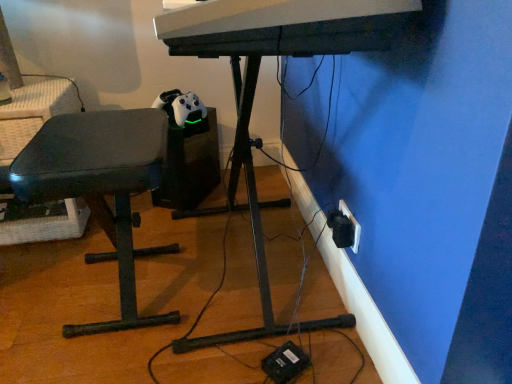
Where is `white plastic computer desk at center`? white plastic computer desk at center is located at coordinates [256, 84].

From the picture: Measure the distance between matte black bench at left and camera.

A distance of 35.08 inches exists between matte black bench at left and camera.

The height and width of the screenshot is (384, 512). Identify the location of white plastic electric outlet at lower right. (353, 225).

Would you say white plastic musical keyboard at upper center is part of white plastic computer desk at center's contents?

No, white plastic musical keyboard at upper center is not surrounded by white plastic computer desk at center.

Is white plastic computer desk at center positioned with its back to white plastic musical keyboard at upper center?

No, white plastic musical keyboard at upper center is not at the back of white plastic computer desk at center.

Does white plastic computer desk at center have a larger size compared to white plastic musical keyboard at upper center?

Yes, white plastic computer desk at center is bigger than white plastic musical keyboard at upper center.

Is the position of white plastic computer desk at center more distant than that of white plastic musical keyboard at upper center?

Yes, white plastic computer desk at center is behind white plastic musical keyboard at upper center.

Considering the sizes of objects white plastic electric outlet at lower right and matte black bench at left in the image provided, who is smaller, white plastic electric outlet at lower right or matte black bench at left?

white plastic electric outlet at lower right.

From the image's perspective, is white plastic electric outlet at lower right above or below matte black bench at left?

Clearly, from the image's perspective, white plastic electric outlet at lower right is below matte black bench at left.

Is white plastic electric outlet at lower right not near matte black bench at left?

That's not correct — white plastic electric outlet at lower right is a little close to matte black bench at left.

Identify the location of electric outlet below the white plastic computer desk at center (from a real-world perspective). The width and height of the screenshot is (512, 384). (353, 225).

From the image's perspective, is white plastic computer desk at center located above or below white plastic electric outlet at lower right?

Based on their image positions, white plastic computer desk at center is located above white plastic electric outlet at lower right.

Is white plastic computer desk at center surrounding white plastic electric outlet at lower right?

No, white plastic electric outlet at lower right is located outside of white plastic computer desk at center.

Can you see white plastic computer desk at center touching white plastic electric outlet at lower right?

There is a gap between white plastic computer desk at center and white plastic electric outlet at lower right.

Is white plastic musical keyboard at upper center oriented towards white plastic computer desk at center?

No, white plastic musical keyboard at upper center is not facing towards white plastic computer desk at center.

Is point (170, 20) closer or farther from the camera than point (257, 28)?

Point (170, 20) appears to be closer to the viewer than point (257, 28).

Consider the image. Can you confirm if white plastic musical keyboard at upper center is bigger than white plastic computer desk at center?

No, white plastic musical keyboard at upper center is not bigger than white plastic computer desk at center.

Looking at this image, do you think white plastic musical keyboard at upper center is within white plastic computer desk at center, or outside of it?

white plastic musical keyboard at upper center exists outside the volume of white plastic computer desk at center.

The width and height of the screenshot is (512, 384). Find the location of `furniture located underneath the white plastic musical keyboard at upper center (from a real-world perspective)`. furniture located underneath the white plastic musical keyboard at upper center (from a real-world perspective) is located at coordinates (101, 187).

Is white plastic musical keyboard at upper center at the left side of matte black bench at left?

Incorrect, white plastic musical keyboard at upper center is not on the left side of matte black bench at left.

Considering the sizes of objects white plastic musical keyboard at upper center and matte black bench at left in the image provided, who is shorter, white plastic musical keyboard at upper center or matte black bench at left?

white plastic musical keyboard at upper center is shorter.

Looking at this image, is the depth of white plastic electric outlet at lower right less than that of white plastic musical keyboard at upper center?

No.

In order to click on musical keyboard in front of the white plastic electric outlet at lower right in this screenshot , I will do `click(283, 27)`.

Does white plastic electric outlet at lower right have a greater width compared to white plastic musical keyboard at upper center?

No.

Is matte black bench at left at the back of white plastic computer desk at center?

Yes, matte black bench at left is at the back of white plastic computer desk at center.

Does point (345, 14) lie in front of point (109, 113)?

Yes.

In the image, is white plastic computer desk at center positioned in front of or behind matte black bench at left?

white plastic computer desk at center is positioned closer to the viewer than matte black bench at left.

Find the location of a particular element. musical keyboard on the left of white plastic computer desk at center is located at coordinates (283, 27).

You are a GUI agent. You are given a task and a screenshot of the screen. Output one action in this format:
    pyautogui.click(x=<x>, y=<y>)
    Task: Click on the furniture that is above the white plastic electric outlet at lower right (from a real-world perspective)
    
    Given the screenshot: What is the action you would take?
    pyautogui.click(x=101, y=187)

From the image, which object appears to be farther from white plastic computer desk at center, white plastic musical keyboard at upper center or matte black bench at left?

white plastic musical keyboard at upper center is further to white plastic computer desk at center.

Looking at the image, which one is located further to matte black bench at left, white plastic electric outlet at lower right or white plastic computer desk at center?

white plastic electric outlet at lower right is positioned further to the anchor matte black bench at left.

Based on their spatial positions, is white plastic electric outlet at lower right or matte black bench at left closer to white plastic computer desk at center?

Among the two, white plastic electric outlet at lower right is located nearer to white plastic computer desk at center.

Which object lies nearer to the anchor point white plastic musical keyboard at upper center, matte black bench at left or white plastic computer desk at center?

matte black bench at left lies closer to white plastic musical keyboard at upper center than the other object.

Looking at the image, which one is located further to matte black bench at left, white plastic computer desk at center or white plastic musical keyboard at upper center?

white plastic musical keyboard at upper center is positioned further to the anchor matte black bench at left.

Considering their positions, is white plastic musical keyboard at upper center positioned further to matte black bench at left than white plastic computer desk at center?

white plastic musical keyboard at upper center lies further to matte black bench at left than the other object.

Looking at the image, which one is located further to white plastic musical keyboard at upper center, white plastic computer desk at center or matte black bench at left?

Based on the image, white plastic computer desk at center appears to be further to white plastic musical keyboard at upper center.

From the image, which object appears to be farther from white plastic electric outlet at lower right, white plastic musical keyboard at upper center or white plastic computer desk at center?

Among the two, white plastic musical keyboard at upper center is located further to white plastic electric outlet at lower right.

Locate an element on the screen. Image resolution: width=512 pixels, height=384 pixels. musical keyboard located between matte black bench at left and white plastic electric outlet at lower right in the left-right direction is located at coordinates (283, 27).

Identify the location of computer desk between matte black bench at left and white plastic electric outlet at lower right. The width and height of the screenshot is (512, 384). (256, 84).

This screenshot has height=384, width=512. In order to click on computer desk between white plastic musical keyboard at upper center and white plastic electric outlet at lower right in the vertical direction in this screenshot , I will do `click(256, 84)`.

Locate an element on the screen. This screenshot has height=384, width=512. computer desk between white plastic musical keyboard at upper center and matte black bench at left in the up-down direction is located at coordinates (256, 84).